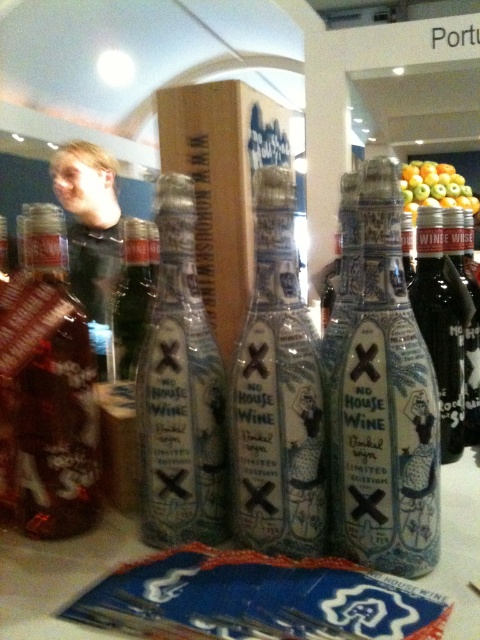
Who is higher up, translucent glass bottle at center or matte black bottle at center?

matte black bottle at center is above.

Does translucent glass bottle at center have a greater height compared to matte black bottle at center?

Indeed, translucent glass bottle at center has a greater height compared to matte black bottle at center.

Is point (204, 376) farther from viewer compared to point (447, 211)?

No, (204, 376) is closer to viewer.

Where is `translucent glass bottle at center`? The height and width of the screenshot is (640, 480). translucent glass bottle at center is located at coordinates (180, 390).

Does matte glass bottle at center appear on the left side of matte black bottle at center?

Correct, you'll find matte glass bottle at center to the left of matte black bottle at center.

The width and height of the screenshot is (480, 640). In order to click on matte glass bottle at center in this screenshot , I will do `click(132, 298)`.

This screenshot has height=640, width=480. I want to click on matte glass bottle at center, so click(132, 298).

The height and width of the screenshot is (640, 480). In order to click on translucent glass bottle at center in this screenshot , I will do `click(180, 390)`.

Is translucent glass bottle at center thinner than shiny metallic bottle at center?

No, translucent glass bottle at center is not thinner than shiny metallic bottle at center.

Does point (167, 337) come closer to viewer compared to point (17, 419)?

Yes, point (167, 337) is closer to viewer.

Locate an element on the screen. The width and height of the screenshot is (480, 640). translucent glass bottle at center is located at coordinates coord(180,390).